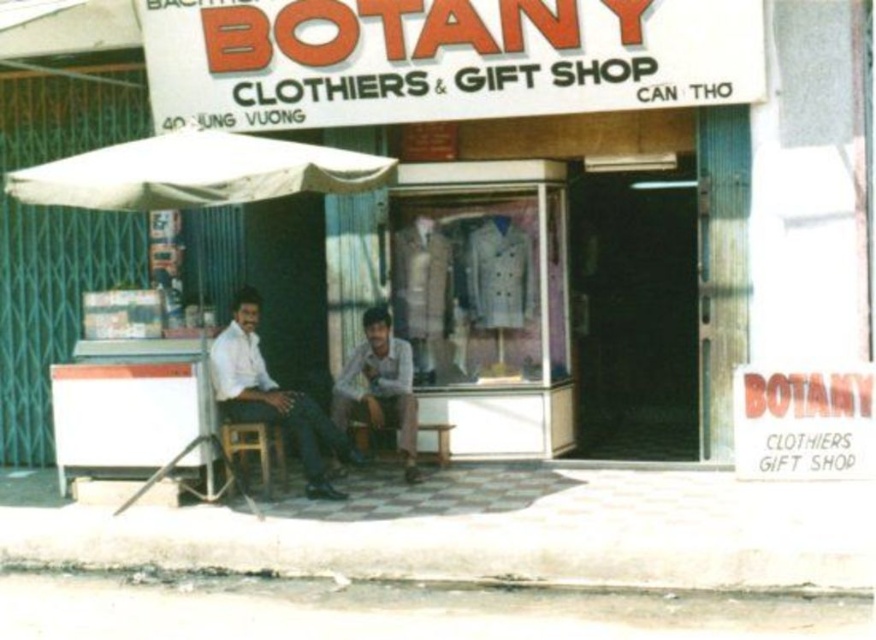
Is the position of light brown leather pants at center less distant than that of wooden stool at lower center?

Yes, light brown leather pants at center is closer to the viewer.

Locate an element on the screen. light brown leather pants at center is located at coordinates (379, 387).

This screenshot has width=876, height=640. I want to click on light brown leather pants at center, so click(379, 387).

Does white fabric canopy at upper left have a lesser height compared to wooden stool at lower center?

No.

Can you confirm if white fabric canopy at upper left is positioned above wooden stool at lower center?

Indeed, white fabric canopy at upper left is positioned over wooden stool at lower center.

Is point (267, 177) farther from camera compared to point (439, 436)?

No, it is not.

This screenshot has width=876, height=640. I want to click on white fabric canopy at upper left, so click(195, 172).

Is light brown leather pants at center wider than wooden chair at lower left?

Yes, light brown leather pants at center is wider than wooden chair at lower left.

Who is more forward, [404,436] or [234,444]?

Positioned in front is point [234,444].

Who is more distant from viewer, (400,445) or (276,451)?

Positioned behind is point (400,445).

Find the location of a particular element. The height and width of the screenshot is (640, 876). light brown leather pants at center is located at coordinates (379, 387).